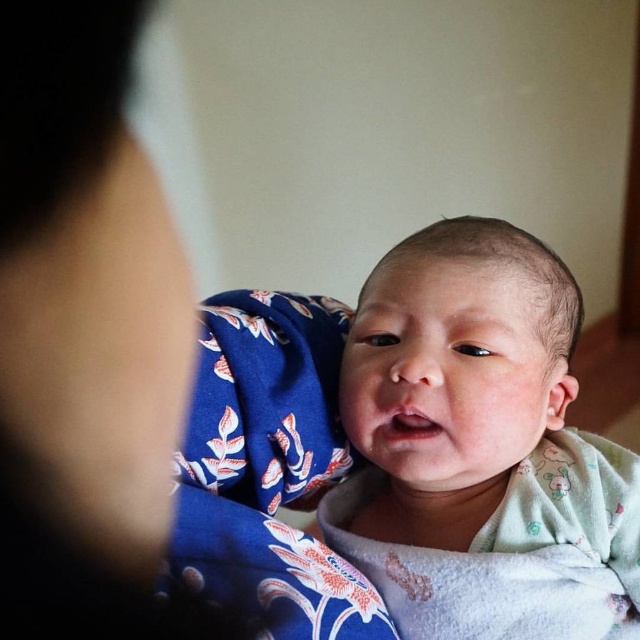
Question: Does smooth skin at upper left lie behind soft white swaddle at center?

Choices:
 (A) yes
 (B) no

Answer: (B)

Question: Does smooth skin at upper left have a lesser width compared to soft white swaddle at center?

Choices:
 (A) yes
 (B) no

Answer: (A)

Question: Which of the following is the closest to the observer?

Choices:
 (A) (26, 628)
 (B) (445, 401)

Answer: (A)

Question: Where is smooth skin at upper left located in relation to soft white swaddle at center in the image?

Choices:
 (A) below
 (B) above

Answer: (B)

Question: Which of the following is the closest to the observer?

Choices:
 (A) 93,289
 (B) 492,448

Answer: (A)